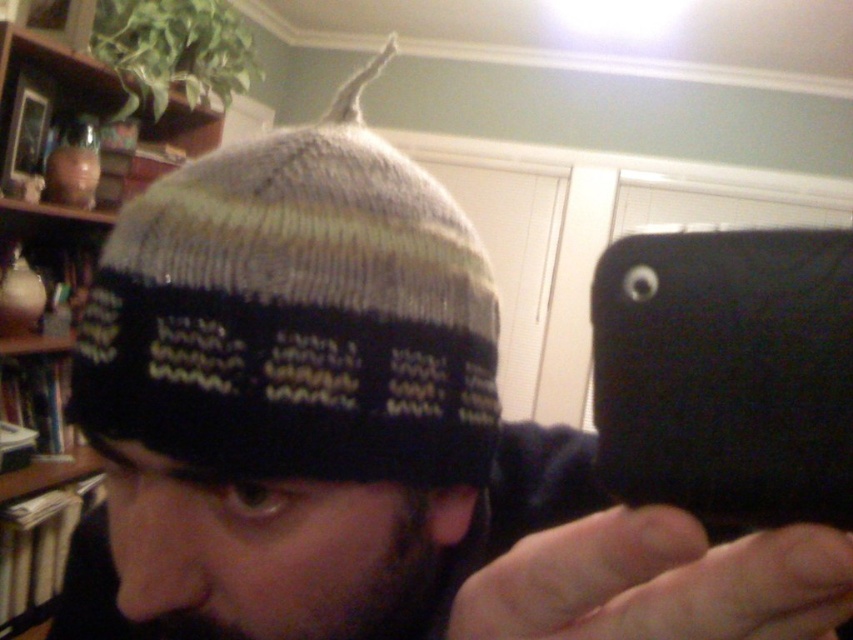
You are an interior designer assessing the placement of items in a room. You see the knitted woolen hat at center and the matte brown vase at upper left. Which object is positioned higher in the room?

The knitted woolen hat at center is positioned higher in the room than the matte brown vase at upper left.

You are organizing a display in a small room and need to arrange the knitted woolen hat at center and the matte brown vase at upper left. Given the space constraints, which object should you place first to ensure both fit comfortably?

The knitted woolen hat at center occupies less space than the matte brown vase at upper left, so you should place the matte brown vase at upper left first to ensure there is enough space for both items.

You are standing in front of the beanie hat shown in the image. There are two points marked on the hat at coordinates point [317,257] and point [80,209]. Which point is closer to you?

Point [317,257] is closer to the viewer than point [80,209].